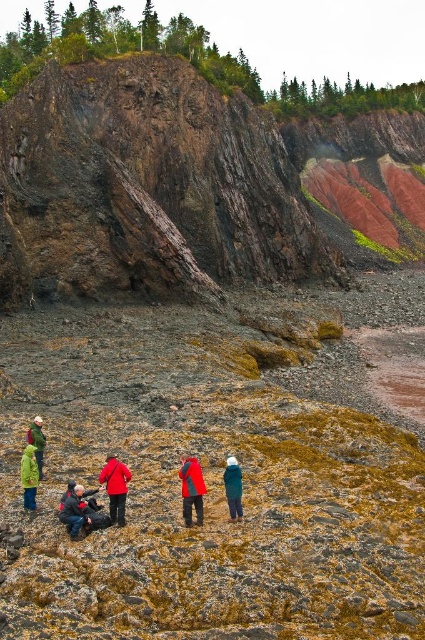
Question: Can you confirm if rusty rock cliff at upper left is positioned to the right of green matte jacket at lower left?

Choices:
 (A) no
 (B) yes

Answer: (B)

Question: Which point is farther from the camera taking this photo?

Choices:
 (A) (39, 444)
 (B) (187, 472)
 (C) (82, 518)

Answer: (A)

Question: Considering the relative positions of dark blue jacket at lower left and green matte jacket at lower left in the image provided, where is dark blue jacket at lower left located with respect to green matte jacket at lower left?

Choices:
 (A) above
 (B) below

Answer: (B)

Question: Observing the image, what is the correct spatial positioning of rusty rock cliff at upper left in reference to red matte jacket at center?

Choices:
 (A) left
 (B) right

Answer: (B)

Question: Which object appears closest to the camera in this image?

Choices:
 (A) red matte jacket at center
 (B) green fabric jacket at lower left
 (C) rusty rock cliff at upper left

Answer: (A)

Question: Among these objects, which one is nearest to the camera?

Choices:
 (A) dark blue jacket at lower left
 (B) green fabric jacket at lower left

Answer: (A)